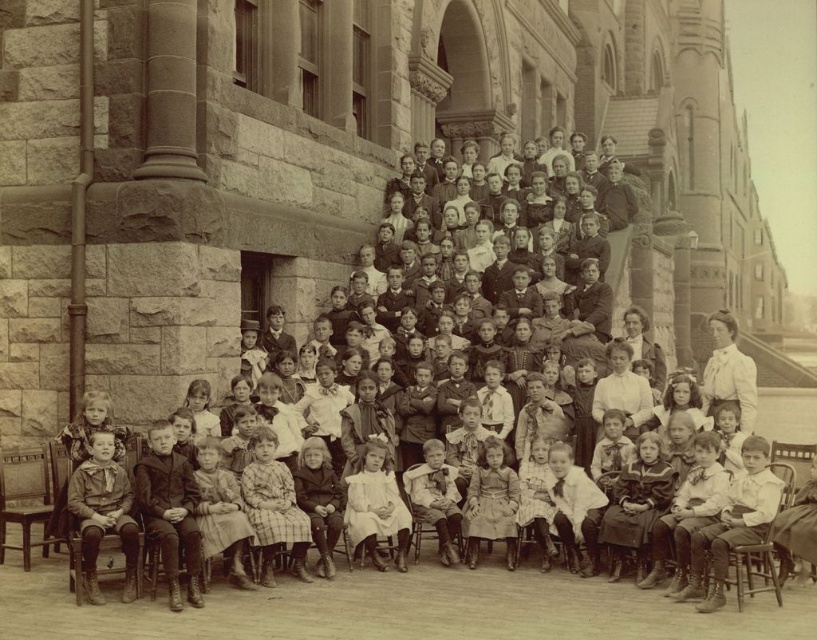
You are a photographer trying to place a new tripod in this scene. The tripod needs to be placed between the matte brown boots at lower left and the wooden at right. Given their widths, which object should the tripod be closer to to ensure it doesn,t block the main subjects?

The matte brown boots at lower left are wider than the wooden at right. To avoid blocking the main subjects, the tripod should be placed closer to the wooden at right since it has less width and would leave more space near the wider boots.

You are a photographer examining this historical image. You notice two items of interest in the lower portion of the image. One is matte brown boots at lower left, and the other is wooden at right. From the perspective of someone standing in front of the image, which of these two items is positioned to the left?

The matte brown boots at lower left are positioned to the left of the wooden at right.